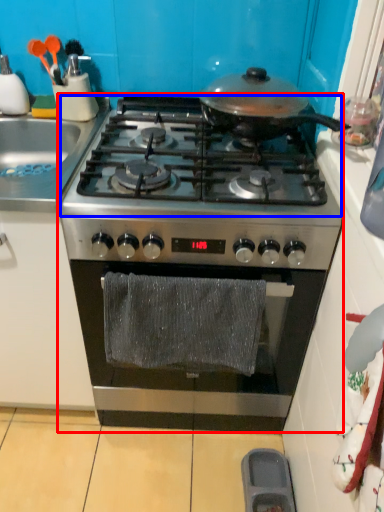
Question: Among these objects, which one is nearest to the camera, gas stove (highlighted by a red box) or gas stove (highlighted by a blue box)?

Choices:
 (A) gas stove
 (B) gas stove

Answer: (B)